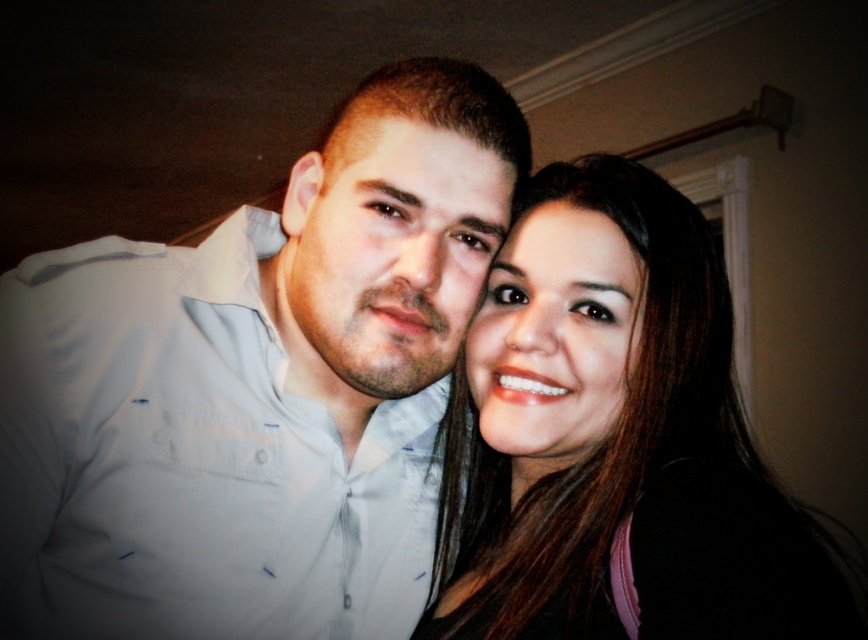
Which of these two, white shirt at center or smooth brown hair at center, stands shorter?

Standing shorter between the two is smooth brown hair at center.

Which is behind, point (412, 326) or point (492, 308)?

Point (492, 308)

Who is more forward, (330, 465) or (586, 332)?

Point (586, 332) is more forward.

Image resolution: width=868 pixels, height=640 pixels. Identify the location of white shirt at center. (255, 387).